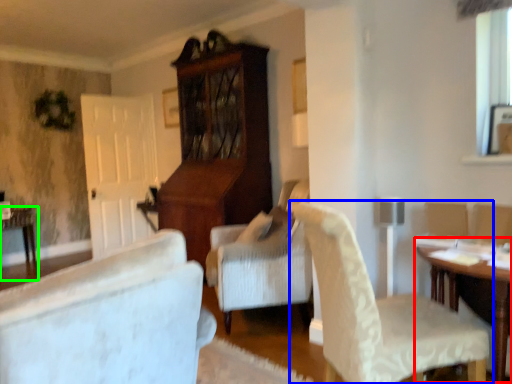
Question: Based on their relative distances, which object is nearer to table (highlighted by a red box)? Choose from chair (highlighted by a blue box) and table (highlighted by a green box).

Choices:
 (A) chair
 (B) table

Answer: (A)